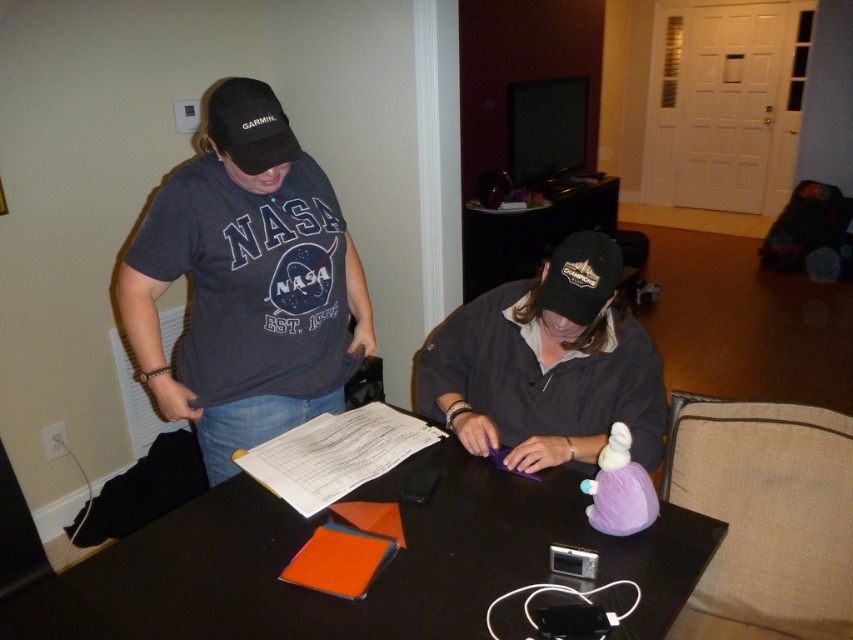
You are a photographer setting up a tripod to capture a closeup of both the black matte cap at center and the black fabric baseball cap at center. The tripod has a maximum reach of 20 centimeters between the two caps. Can you fit both caps into the frame without moving the tripod?

The black matte cap at center is 18.28 centimeters away from the black fabric baseball cap at center. Since the tripod can reach up to 20 centimeters, it can accommodate the distance between them, so yes, both caps can be captured in the frame without moving the tripod.